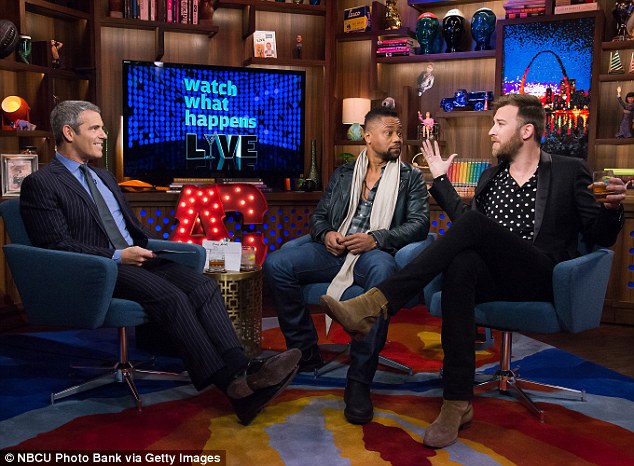
Image resolution: width=634 pixels, height=466 pixels. I want to click on cocktail glass, so click(212, 141).